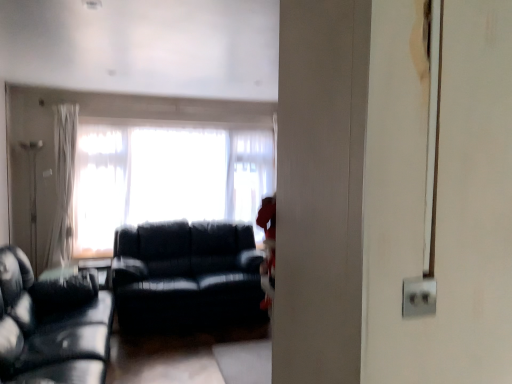
Question: From the image's perspective, is white sheer curtain at left positioned above or below black leather couch at left, which ranks as the first studio couch in front-to-back order?

Choices:
 (A) above
 (B) below

Answer: (A)

Question: Relative to black leather couch at left, which ranks as the first studio couch in front-to-back order, is white sheer curtain at left in front or behind?

Choices:
 (A) front
 (B) behind

Answer: (B)

Question: Which of these objects is positioned closest to the white glossy screen door at right?

Choices:
 (A) translucent fabric window at center
 (B) black leather couch at left, which ranks as the first studio couch in front-to-back order
 (C) white sheer curtain at left
 (D) matte black couch at center, the 2th studio couch when ordered from front to back

Answer: (B)

Question: Based on their relative distances, which object is nearer to the white glossy screen door at right?

Choices:
 (A) white sheer curtain at left
 (B) matte black couch at center, the 2th studio couch when ordered from front to back
 (C) black leather couch at left, the 2th studio couch in the back-to-front sequence
 (D) translucent fabric window at center

Answer: (C)